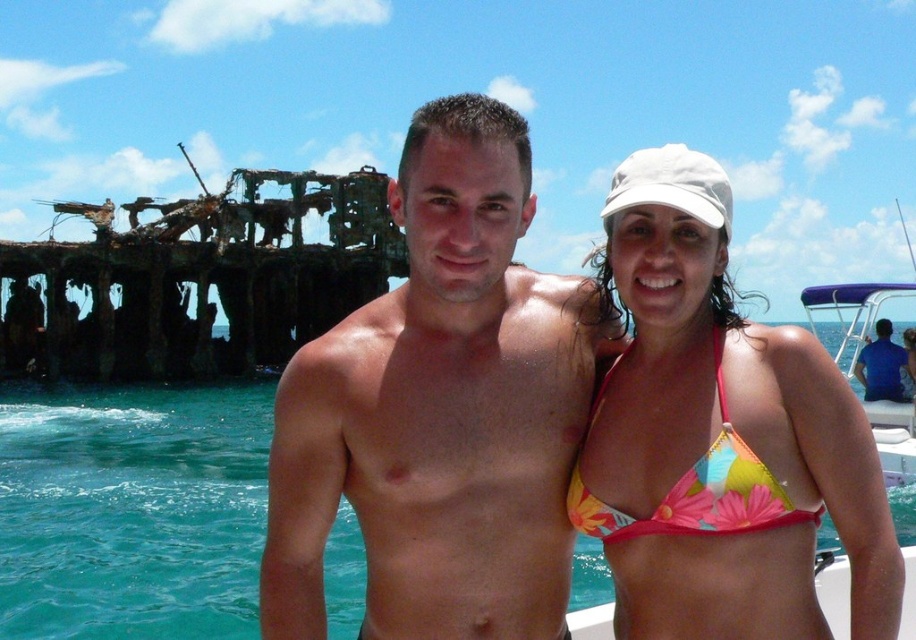
From the picture: You are a photographer trying to capture a photo of the blue cotton shirt at lower right without the purple fabric boat at right blocking it. What should you do?

Move the camera to the left side so that the purple fabric boat at right is no longer in front of the blue cotton shirt at lower right. Since the purple fabric boat at right is currently in front, moving left would allow you to see the blue cotton shirt at lower right without obstruction.

You are a photographer trying to capture a photo of the purple fabric boat at right and the blue cotton shirt at lower right in the scene. Since you want both objects to be clearly visible in the photo, which object should you focus on first to ensure proper depth of field?

The purple fabric boat at right is much taller than the blue cotton shirt at lower right. To ensure both are in focus, you should focus on the blue cotton shirt at lower right first since it is closer to the camera.